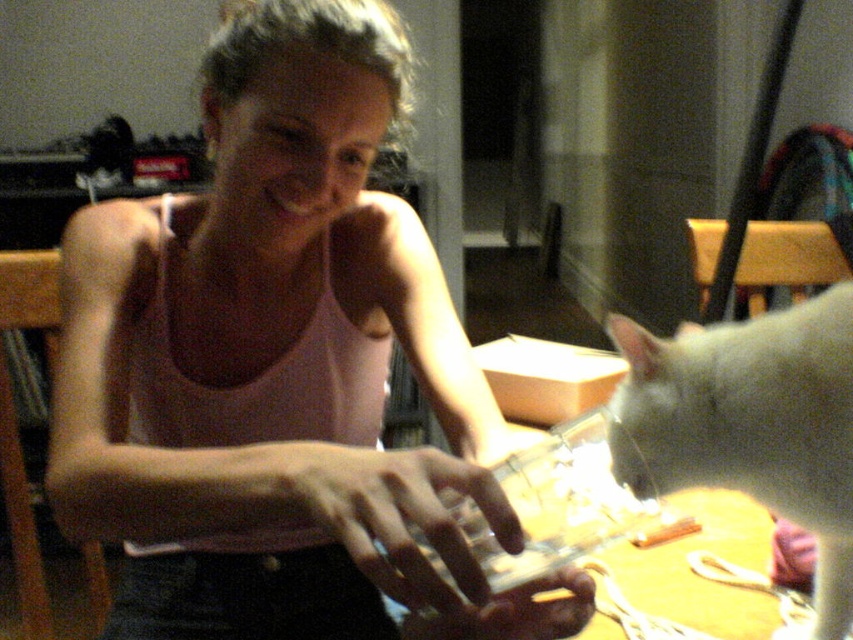
Question: Which point is closer to the camera?

Choices:
 (A) white fur cat at lower right
 (B) pink matte tank top at center
 (C) yellow wood table at center

Answer: (B)

Question: Which point is closer to the camera taking this photo?

Choices:
 (A) (639, 451)
 (B) (558, 442)
 (C) (277, 68)

Answer: (A)

Question: Among these objects, which one is farthest from the camera?

Choices:
 (A) yellow wood table at center
 (B) white fur cat at lower right

Answer: (B)

Question: Does pink matte tank top at center have a lesser width compared to yellow wood table at center?

Choices:
 (A) no
 (B) yes

Answer: (A)

Question: Can you confirm if white fur cat at lower right is bigger than yellow wood table at center?

Choices:
 (A) no
 (B) yes

Answer: (A)

Question: Does pink matte tank top at center appear on the left side of white fur cat at lower right?

Choices:
 (A) no
 (B) yes

Answer: (B)